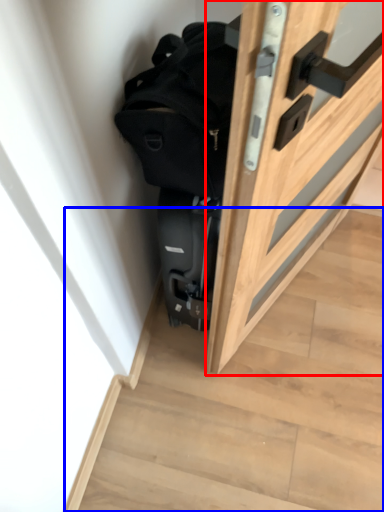
Question: Which point is closer to the camera, door (highlighted by a red box) or stairwell (highlighted by a blue box)?

Choices:
 (A) door
 (B) stairwell

Answer: (A)